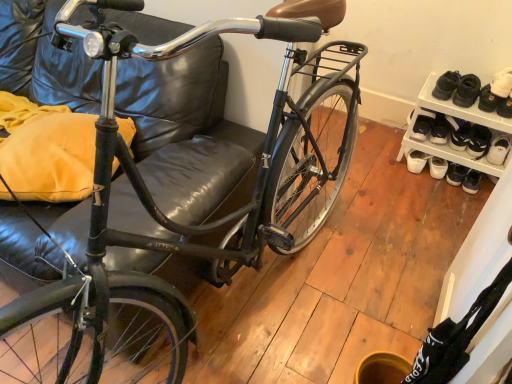
Question: Is white leather shoe at upper right, the first footwear from the right, smaller than white suede shoe at upper right?

Choices:
 (A) yes
 (B) no

Answer: (A)

Question: Could white suede shoe at upper right be considered to be inside white leather shoe at upper right, the first footwear from the right?

Choices:
 (A) no
 (B) yes

Answer: (A)

Question: From a real-world perspective, is white leather shoe at upper right, the first footwear from the right, on white suede shoe at upper right?

Choices:
 (A) yes
 (B) no

Answer: (B)

Question: Does white leather shoe at upper right, which is the second footwear in left-to-right order, appear on the right side of white suede shoe at upper right?

Choices:
 (A) yes
 (B) no

Answer: (A)

Question: From the image's perspective, is white leather shoe at upper right, the first footwear from the right, over white suede shoe at upper right?

Choices:
 (A) no
 (B) yes

Answer: (A)

Question: Is white leather shoe at upper right, which is the second footwear in left-to-right order, positioned in front of white suede shoe at upper right?

Choices:
 (A) yes
 (B) no

Answer: (B)

Question: From the image's perspective, does shiny black bicycle at center appear lower than white suede shoe at upper right?

Choices:
 (A) no
 (B) yes

Answer: (B)

Question: From a real-world perspective, is shiny black bicycle at center under white suede shoe at upper right?

Choices:
 (A) no
 (B) yes

Answer: (A)

Question: Is shiny black bicycle at center at the left side of white suede shoe at upper right?

Choices:
 (A) no
 (B) yes

Answer: (B)

Question: Can you confirm if shiny black bicycle at center is smaller than white suede shoe at upper right?

Choices:
 (A) yes
 (B) no

Answer: (B)

Question: Would you say shiny black bicycle at center is outside white suede shoe at upper right?

Choices:
 (A) yes
 (B) no

Answer: (A)

Question: Considering the relative positions of shiny black bicycle at center and white suede shoe at upper right in the image provided, is shiny black bicycle at center behind white suede shoe at upper right?

Choices:
 (A) no
 (B) yes

Answer: (A)

Question: Is white suede shoe at upper right outside of white leather shoe at upper right, which is the second footwear in left-to-right order?

Choices:
 (A) yes
 (B) no

Answer: (A)